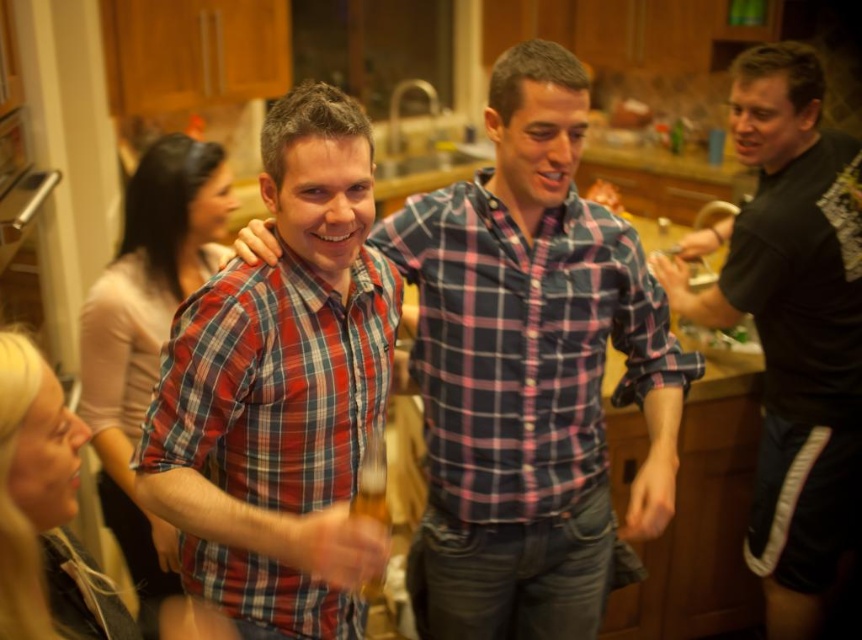
Does point (825, 196) lie in front of point (354, 284)?

No, (825, 196) is behind (354, 284).

Does black matte shirt at right come in front of red plaid shirt at center?

No, black matte shirt at right is behind red plaid shirt at center.

Find the location of `black matte shirt at right`. black matte shirt at right is located at coordinates (791, 324).

Find the location of a particular element. The image size is (862, 640). black matte shirt at right is located at coordinates (791, 324).

Between point (606, 250) and point (854, 154), which one is positioned in front?

Point (606, 250) is in front.

What do you see at coordinates (523, 344) in the screenshot? I see `plaid cotton shirt at center` at bounding box center [523, 344].

You are a GUI agent. You are given a task and a screenshot of the screen. Output one action in this format:
    pyautogui.click(x=<x>, y=<y>)
    Task: Click on the plaid cotton shirt at center
    
    Given the screenshot: What is the action you would take?
    pyautogui.click(x=523, y=344)

Between plaid shirt at center and red plaid shirt at center, which one is positioned lower?

red plaid shirt at center

How much distance is there between plaid shirt at center and red plaid shirt at center?

plaid shirt at center and red plaid shirt at center are 15.08 inches apart from each other.

Find the location of `plaid shirt at center`. plaid shirt at center is located at coordinates (529, 371).